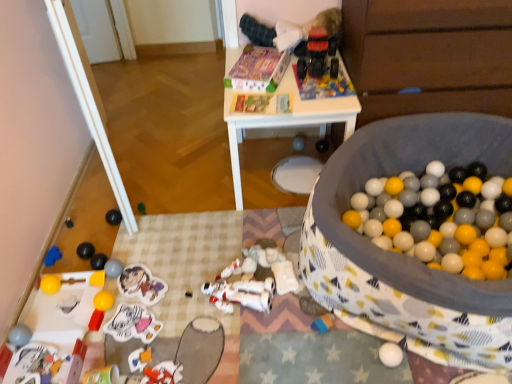
Question: Should I look upward or downward to see plastic toy at lower left, marked as the twelfth toy in a left-to-right arrangement?

Choices:
 (A) up
 (B) down

Answer: (B)

Question: Is shiny green ball at center, the 11th toy positioned from the left, positioned beyond the bounds of smooth black ball at lower left, the first toy from the left?

Choices:
 (A) no
 (B) yes

Answer: (B)

Question: Does shiny green ball at center, the eleventh toy in the right-to-left sequence, have a lesser width compared to smooth black ball at lower left, the 21th toy from the right?

Choices:
 (A) yes
 (B) no

Answer: (A)

Question: From the image's perspective, is shiny green ball at center, the eleventh toy in the right-to-left sequence, over smooth black ball at lower left, the 21th toy from the right?

Choices:
 (A) yes
 (B) no

Answer: (A)

Question: Can you confirm if shiny green ball at center, the eleventh toy in the right-to-left sequence, is smaller than smooth black ball at lower left, the 21th toy from the right?

Choices:
 (A) no
 (B) yes

Answer: (A)

Question: From a real-world perspective, is shiny green ball at center, the eleventh toy in the right-to-left sequence, under smooth black ball at lower left, the 21th toy from the right?

Choices:
 (A) yes
 (B) no

Answer: (B)

Question: From a real-world perspective, is shiny green ball at center, the 11th toy positioned from the left, on top of smooth black ball at lower left, the 21th toy from the right?

Choices:
 (A) yes
 (B) no

Answer: (A)

Question: From a real-world perspective, is rubberized red toy truck at upper center, the nineteenth toy from the left, positioned under plastic toy at lower left, marked as the tenth toy in a right-to-left arrangement, based on gravity?

Choices:
 (A) no
 (B) yes

Answer: (A)

Question: Can you confirm if rubberized red toy truck at upper center, the 3th toy from the right, is shorter than plastic toy at lower left, marked as the tenth toy in a right-to-left arrangement?

Choices:
 (A) no
 (B) yes

Answer: (A)

Question: Is rubberized red toy truck at upper center, the 3th toy from the right, positioned with its back to plastic toy at lower left, marked as the tenth toy in a right-to-left arrangement?

Choices:
 (A) yes
 (B) no

Answer: (B)

Question: Is rubberized red toy truck at upper center, the 3th toy from the right, touching plastic toy at lower left, marked as the tenth toy in a right-to-left arrangement?

Choices:
 (A) no
 (B) yes

Answer: (A)

Question: Is rubberized red toy truck at upper center, the 3th toy from the right, closer to camera compared to plastic toy at lower left, marked as the twelfth toy in a left-to-right arrangement?

Choices:
 (A) no
 (B) yes

Answer: (A)

Question: Is rubberized red toy truck at upper center, the nineteenth toy from the left, to the left of plastic toy at lower left, marked as the tenth toy in a right-to-left arrangement, from the viewer's perspective?

Choices:
 (A) yes
 (B) no

Answer: (B)

Question: From the image's perspective, would you say rubberized red toy at lower left, the 14th toy positioned from the right, is positioned over soft fabric ball pit at center, marked as the first toy in a right-to-left arrangement?

Choices:
 (A) yes
 (B) no

Answer: (B)